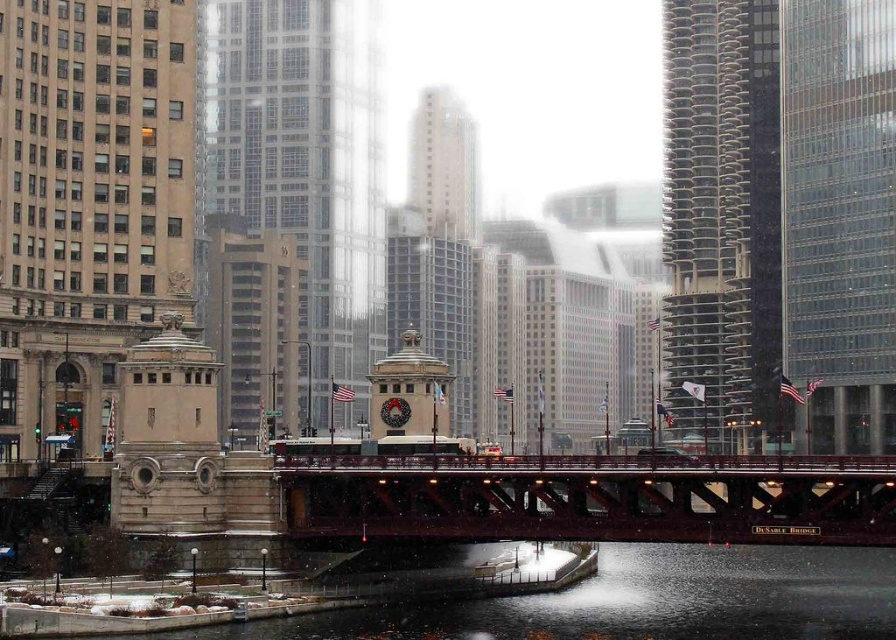
Question: Which object appears closest to the camera in this image?

Choices:
 (A) smooth concrete river at center
 (B) metallic red bridge at center
 (C) white glass building at center
 (D) clear glass skyscraper at center

Answer: (A)

Question: Does metallic red bridge at center appear over smooth concrete river at center?

Choices:
 (A) no
 (B) yes

Answer: (B)

Question: Among these points, which one is nearest to the camera?

Choices:
 (A) (782, 550)
 (B) (795, 364)

Answer: (A)

Question: Based on their relative distances, which object is farther from the clear glass skyscraper at center?

Choices:
 (A) smooth concrete river at center
 (B) beige stone tower at left

Answer: (A)

Question: Does beige stone tower at center have a lesser width compared to white glass building at center?

Choices:
 (A) no
 (B) yes

Answer: (A)

Question: Is clear glass skyscraper at center closer to camera compared to smooth concrete river at center?

Choices:
 (A) yes
 (B) no

Answer: (B)